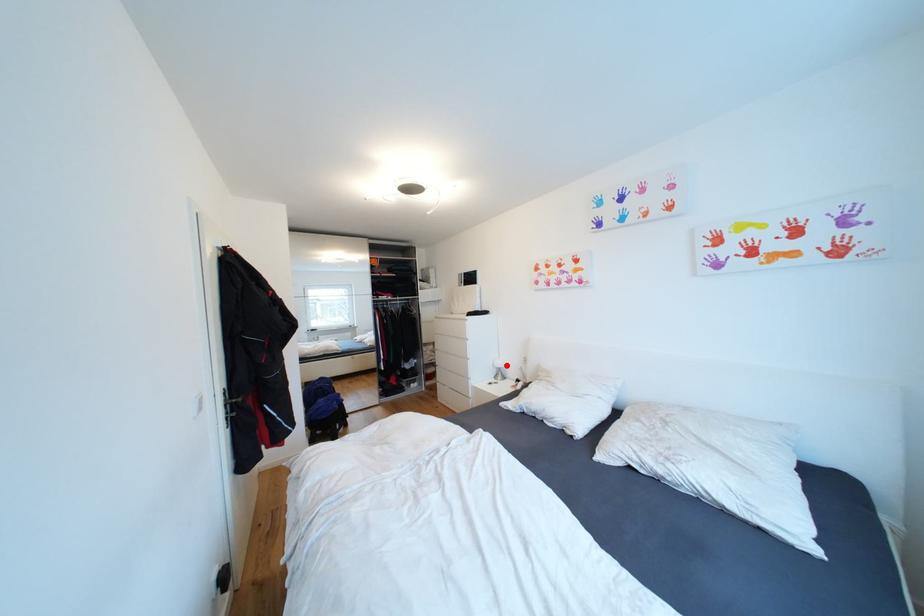
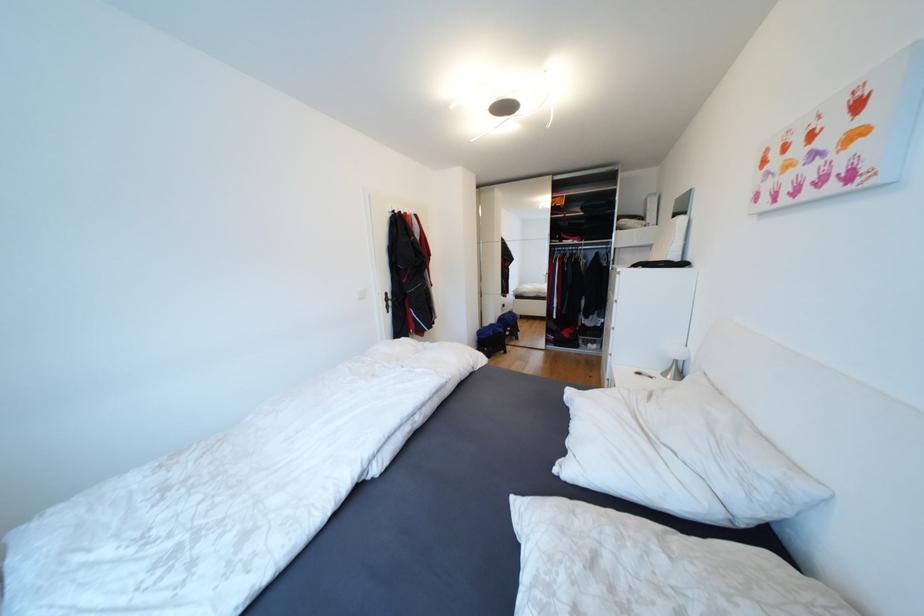
Where in the second image is the point corresponding to the highlighted location from the first image?

(682, 354)